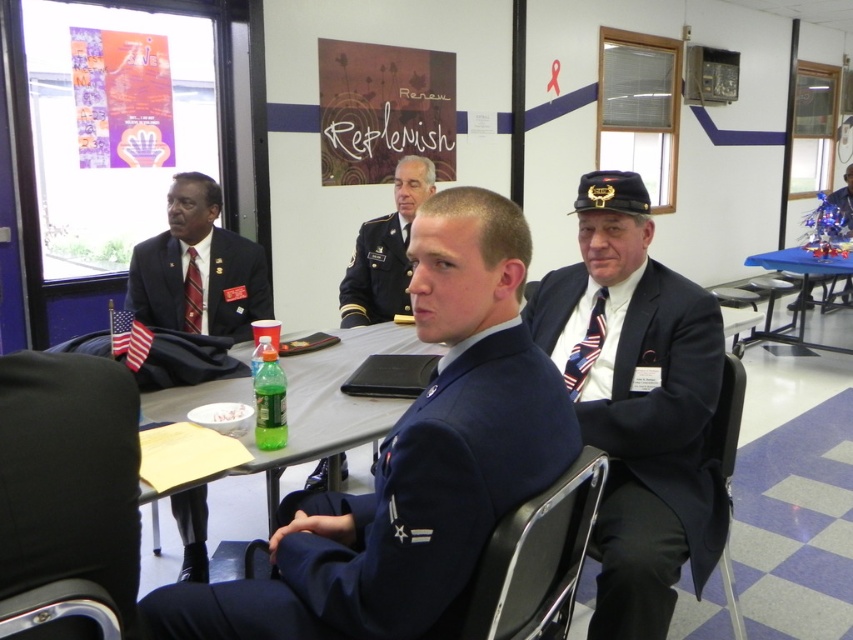
Question: Does dark blue suit at left have a larger size compared to clear plastic bottle at center?

Choices:
 (A) yes
 (B) no

Answer: (B)

Question: Among these points, which one is nearest to the camera?

Choices:
 (A) (183, 390)
 (B) (167, 285)
 (C) (776, 340)
 (D) (688, 428)

Answer: (D)

Question: Considering the relative positions of navy blue uniform at center and american flag patterned tie at right in the image provided, where is navy blue uniform at center located with respect to american flag patterned tie at right?

Choices:
 (A) left
 (B) right

Answer: (A)

Question: Which object appears farthest from the camera in this image?

Choices:
 (A) blue uniform at center
 (B) black fabric chair at right
 (C) navy blue uniform at center
 (D) blue fabric table at right

Answer: (D)

Question: Which point is closer to the camera taking this photo?

Choices:
 (A) (33, 604)
 (B) (805, 266)
 (C) (602, 339)

Answer: (A)

Question: Can you confirm if dark blue suit at left is positioned to the left of clear plastic bottle at center?

Choices:
 (A) yes
 (B) no

Answer: (A)